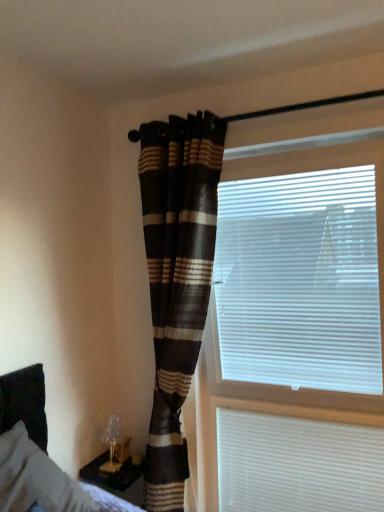
Question: Visually, is white plastic blinds at lower right, the second window blind positioned from the top, positioned to the left or to the right of plaid fabric curtain at center?

Choices:
 (A) left
 (B) right

Answer: (B)

Question: Considering the positions of white plastic blinds at lower right, the second window blind positioned from the top, and plaid fabric curtain at center in the image, is white plastic blinds at lower right, the second window blind positioned from the top, wider or thinner than plaid fabric curtain at center?

Choices:
 (A) thin
 (B) wide

Answer: (A)

Question: Which object is the closest to the plaid fabric curtain at center?

Choices:
 (A) white plastic blinds at right, which is the 2th window blind in bottom-to-top order
 (B) white plastic blinds at lower right, the second window blind positioned from the top
 (C) gray fabric bed at lower left

Answer: (A)

Question: Estimate the real-world distances between objects in this image. Which object is closer to the white plastic blinds at lower right, the second window blind positioned from the top?

Choices:
 (A) white plastic blinds at right, which ranks as the first window blind in top-to-bottom order
 (B) gray fabric bed at lower left
 (C) plaid fabric curtain at center

Answer: (A)